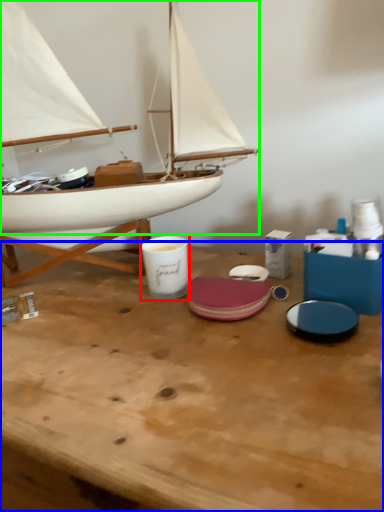
Question: Estimate the real-world distances between objects in this image. Which object is closer to tableware (highlighted by a red box), table (highlighted by a blue box) or boat (highlighted by a green box)?

Choices:
 (A) table
 (B) boat

Answer: (A)